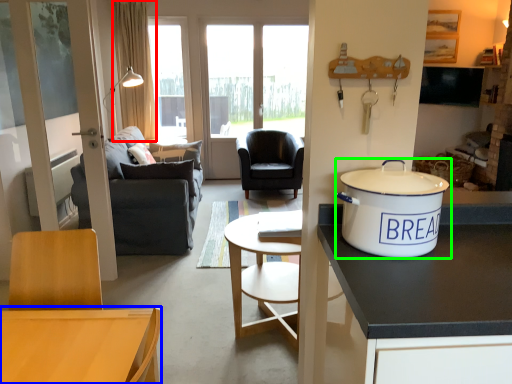
Question: Considering the real-world distances, which object is closest to curtain (highlighted by a red box)? desk (highlighted by a blue box) or tableware (highlighted by a green box).

Choices:
 (A) desk
 (B) tableware

Answer: (A)